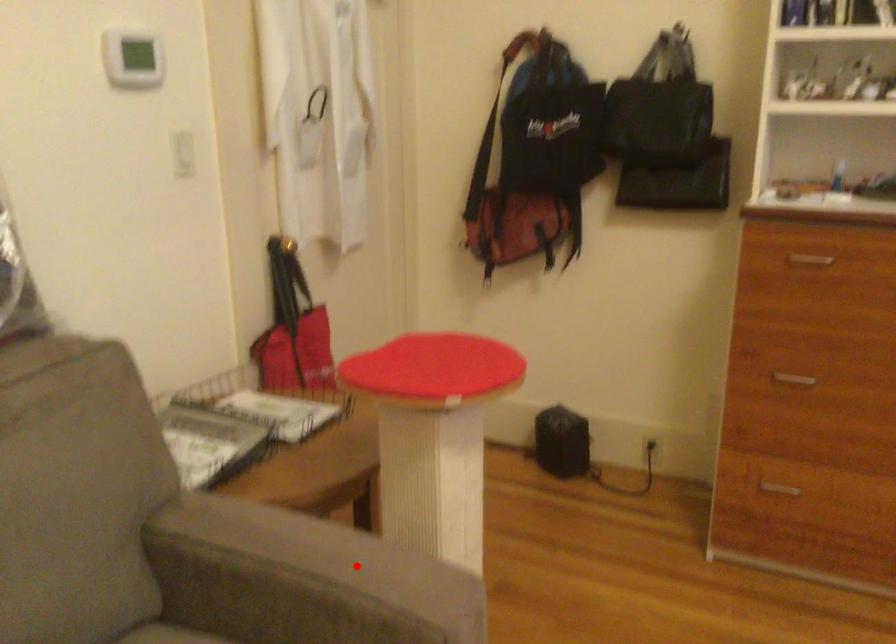
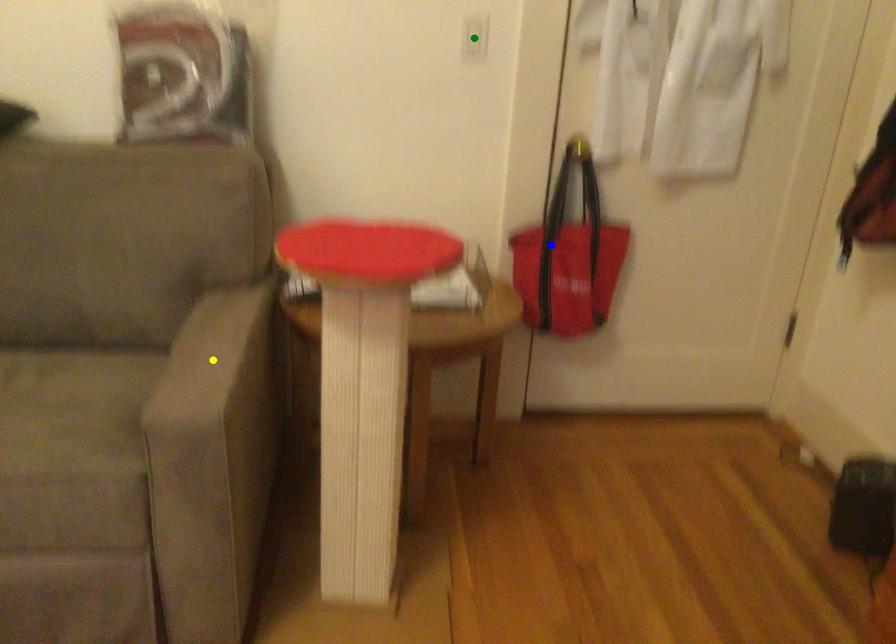
Question: I am providing you with two images of the same scene from different viewpoints. A red point is marked on the first image. You are given multiple points on the second image. Which spot in image 2 lines up with the point in image 1?

Choices:
 (A) yellow point
 (B) blue point
 (C) green point

Answer: (A)